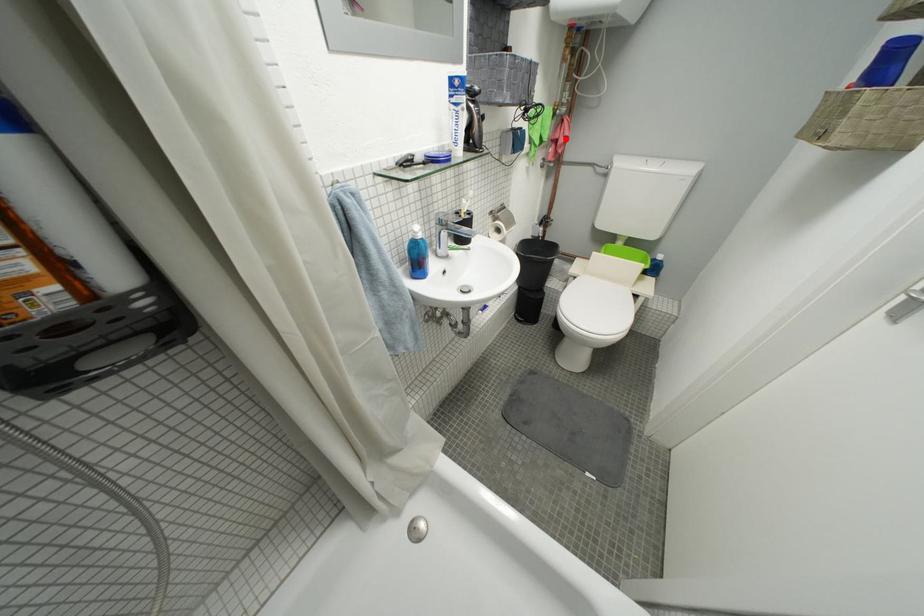
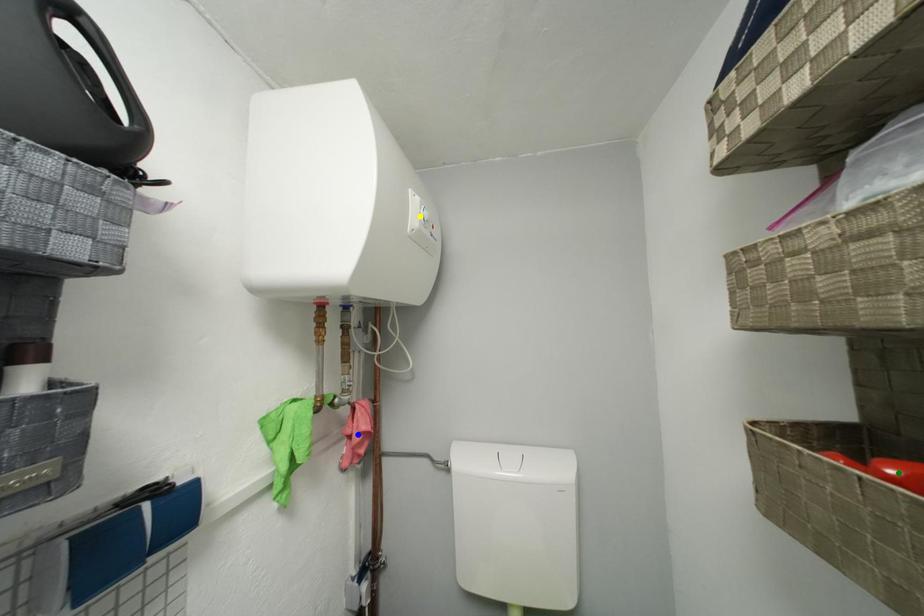
Question: I am providing you with two images of the same scene from different viewpoints. A red point is marked on the first image. You are given multiple points on the second image. Can you choose the point in image 2 that corresponds to the point in image 1?

Choices:
 (A) green point
 (B) blue point
 (C) yellow point

Answer: (B)